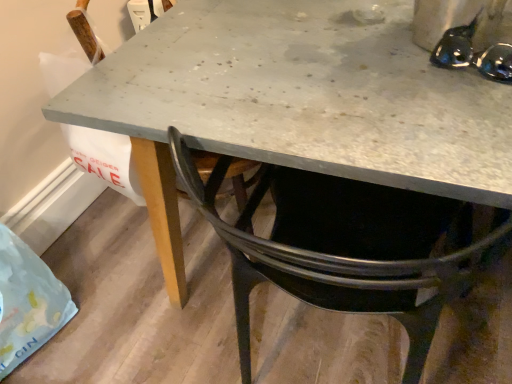
What do you see at coordinates (346, 247) in the screenshot? I see `metallic black chair at center` at bounding box center [346, 247].

I want to click on metallic black chair at center, so click(346, 247).

Where is `metallic black chair at center`? metallic black chair at center is located at coordinates (346, 247).